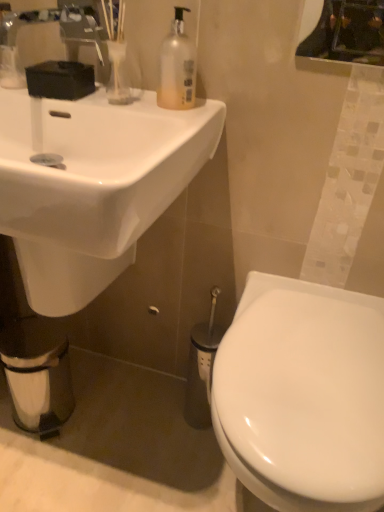
Question: Should I look upward or downward to see translucent plastic soap dispenser at upper center?

Choices:
 (A) down
 (B) up

Answer: (B)

Question: Should I look upward or downward to see white glossy toilet at lower right?

Choices:
 (A) up
 (B) down

Answer: (B)

Question: Is white matte toilet paper at lower left to the left of white glossy toilet at lower right from the viewer's perspective?

Choices:
 (A) yes
 (B) no

Answer: (A)

Question: Would you say white matte toilet paper at lower left is outside white glossy toilet at lower right?

Choices:
 (A) no
 (B) yes

Answer: (B)

Question: Is white matte toilet paper at lower left far from white glossy toilet at lower right?

Choices:
 (A) yes
 (B) no

Answer: (B)

Question: Does white matte toilet paper at lower left have a greater height compared to white glossy toilet at lower right?

Choices:
 (A) no
 (B) yes

Answer: (A)

Question: Does white matte toilet paper at lower left have a lesser width compared to white glossy toilet at lower right?

Choices:
 (A) yes
 (B) no

Answer: (A)

Question: Can you confirm if white matte toilet paper at lower left is wider than white glossy toilet at lower right?

Choices:
 (A) yes
 (B) no

Answer: (B)

Question: Considering the relative positions of white glossy sink at upper left and translucent plastic soap dispenser at upper center in the image provided, is white glossy sink at upper left to the right of translucent plastic soap dispenser at upper center from the viewer's perspective?

Choices:
 (A) no
 (B) yes

Answer: (A)

Question: Does white glossy sink at upper left have a greater width compared to translucent plastic soap dispenser at upper center?

Choices:
 (A) yes
 (B) no

Answer: (A)

Question: Does white glossy sink at upper left have a lesser width compared to translucent plastic soap dispenser at upper center?

Choices:
 (A) yes
 (B) no

Answer: (B)

Question: Is the surface of white glossy sink at upper left in direct contact with translucent plastic soap dispenser at upper center?

Choices:
 (A) no
 (B) yes

Answer: (A)

Question: Could you tell me if white glossy sink at upper left is facing translucent plastic soap dispenser at upper center?

Choices:
 (A) no
 (B) yes

Answer: (A)

Question: Is white glossy sink at upper left outside translucent plastic soap dispenser at upper center?

Choices:
 (A) no
 (B) yes

Answer: (B)

Question: Considering the relative sizes of white glossy sink at upper left and metallic reflective mirror at upper right in the image provided, is white glossy sink at upper left thinner than metallic reflective mirror at upper right?

Choices:
 (A) no
 (B) yes

Answer: (A)